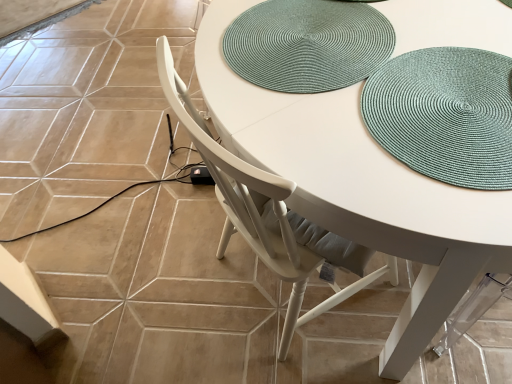
Locate an element on the screen. The width and height of the screenshot is (512, 384). blank area to the left of teal woven placemat at upper right is located at coordinates (298, 112).